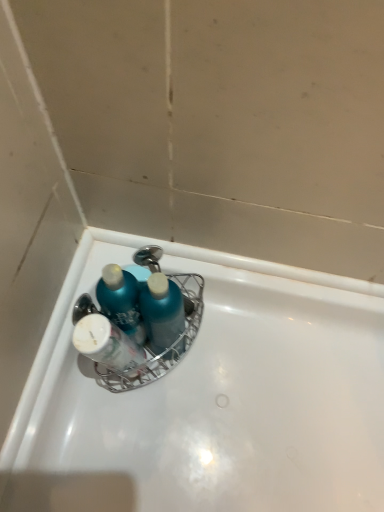
You are a GUI agent. You are given a task and a screenshot of the screen. Output one action in this format:
    pyautogui.click(x=<x>, y=<y>)
    Task: Click on the free point in front of blue glossy bottle at upper center
    This screenshot has width=384, height=512.
    Given the screenshot: What is the action you would take?
    pyautogui.click(x=127, y=428)